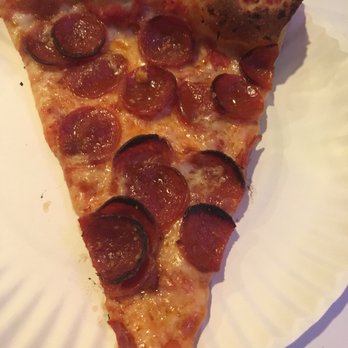
Locate an element on the screen. paper plate is located at coordinates (64, 278).